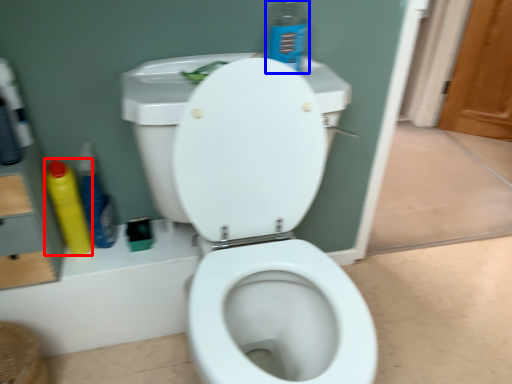
Question: Which object appears farthest to the camera in this image, cleaning product (highlighted by a red box) or cleaning product (highlighted by a blue box)?

Choices:
 (A) cleaning product
 (B) cleaning product

Answer: (A)